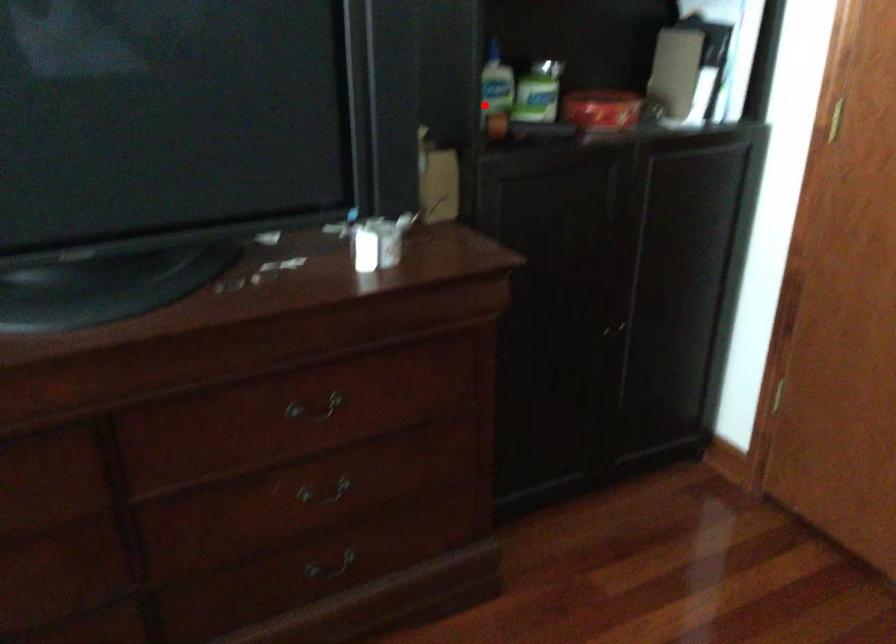
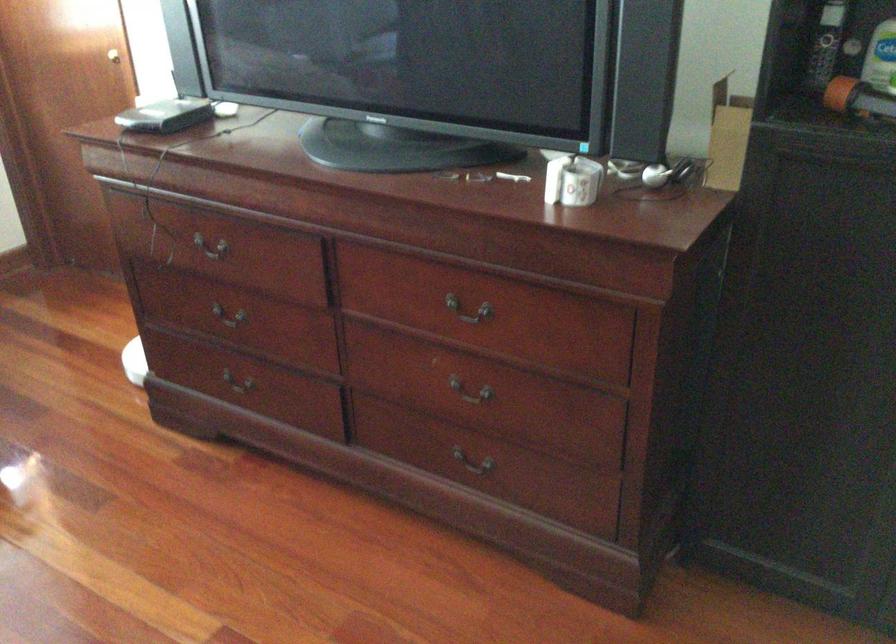
Question: I am providing you with two images of the same scene from different viewpoints. Given a red point in image1, look at the same physical point in image2. Is it:

Choices:
 (A) Closer to the viewpoint
 (B) Farther from the viewpoint

Answer: (A)